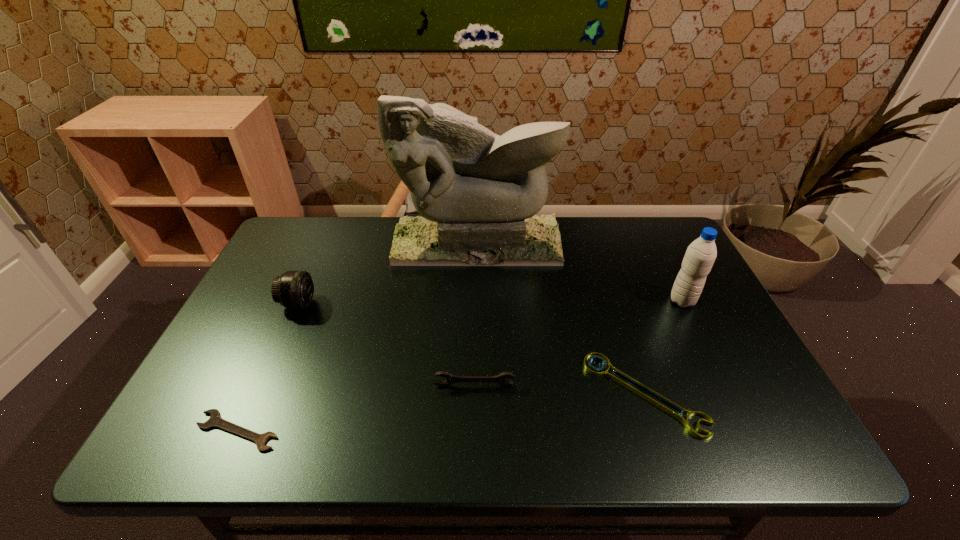
The width and height of the screenshot is (960, 540). I want to click on vacant region between the shortest wrench and the third shortest object, so click(x=356, y=408).

You are a GUI agent. You are given a task and a screenshot of the screen. Output one action in this format:
    pyautogui.click(x=<x>, y=<y>)
    Task: Click on the free space that is in between the fourth tallest object and the tallest object
    
    Given the screenshot: What is the action you would take?
    pyautogui.click(x=475, y=314)

Locate an element on the screen. The image size is (960, 540). free space between the second wrench from right to left and the sculpture is located at coordinates (475, 314).

Find the location of a particular element. Image resolution: width=960 pixels, height=540 pixels. empty space that is in between the third tallest object and the fourth tallest object is located at coordinates (386, 345).

Locate an element on the screen. The width and height of the screenshot is (960, 540). vacant area that lies between the second tallest object and the telephoto lens is located at coordinates (491, 302).

Find the location of a particular element. The image size is (960, 540). blank region between the telephoto lens and the second wrench from left to right is located at coordinates (x=386, y=345).

Identify the location of empty space that is in between the telephoto lens and the second tallest object. (491, 302).

Find the location of a particular element. The height and width of the screenshot is (540, 960). free space between the tallest wrench and the rightmost object is located at coordinates (578, 343).

The image size is (960, 540). Identify the location of vacant area between the sculpture and the second shortest object. (561, 319).

Identify which object is the second nearest to the fifth tallest object. Please provide its 2D coordinates. Your answer should be formatted as a tuple, i.e. [(x, y)], where the tuple contains the x and y coordinates of a point satisfying the conditions above.

[(450, 379)]